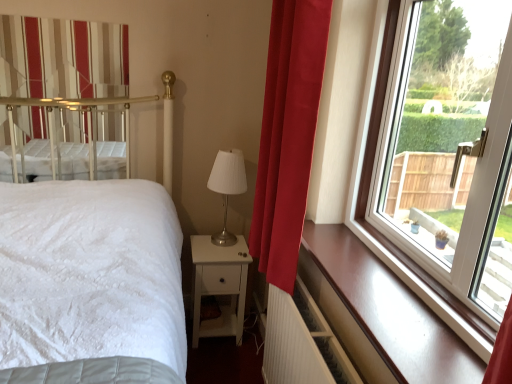
Image resolution: width=512 pixels, height=384 pixels. What do you see at coordinates (380, 314) in the screenshot? I see `glossy wood window sill at right` at bounding box center [380, 314].

What do you see at coordinates (227, 187) in the screenshot?
I see `metallic silver table lamp at center` at bounding box center [227, 187].

I want to click on white ribbed radiator at lower right, so click(302, 342).

Identify the location of velvet red curtain at right, which is the 2th curtain from back to front. The height and width of the screenshot is (384, 512). pos(288,135).

The image size is (512, 384). Describe the element at coordinates (448, 147) in the screenshot. I see `transparent glass window at right` at that location.

Identify the location of striped fabric curtain at upper left, the 1th curtain viewed from the left. (62, 58).

Where is `glossy wood window sill at right`? The image size is (512, 384). glossy wood window sill at right is located at coordinates (380, 314).

Would you say white matte nightstand at lower center is outside velvet red curtain at right, the first curtain when ordered from front to back?

white matte nightstand at lower center is positioned outside velvet red curtain at right, the first curtain when ordered from front to back.

Can you tell me how much white matte nightstand at lower center and velvet red curtain at right, which appears as the first curtain when viewed from the right, differ in facing direction?

There is a 89.6-degree angle between the facing directions of white matte nightstand at lower center and velvet red curtain at right, which appears as the first curtain when viewed from the right.

From the image's perspective, which is below, white matte nightstand at lower center or velvet red curtain at right, which is the 2th curtain from left to right?

From the image's view, white matte nightstand at lower center is below.

How far apart are white matte nightstand at lower center and velvet red curtain at right, which is the 2th curtain from left to right?

A distance of 31.47 inches exists between white matte nightstand at lower center and velvet red curtain at right, which is the 2th curtain from left to right.

Does point (28, 116) appear closer or farther from the camera than point (295, 96)?

Point (28, 116) is positioned farther from the camera compared to point (295, 96).

Between striped fabric curtain at upper left, the 1th curtain in the back-to-front sequence, and velvet red curtain at right, the first curtain when ordered from front to back, which one has more height?

velvet red curtain at right, the first curtain when ordered from front to back, is taller.

From the image's perspective, is striped fabric curtain at upper left, which is the second curtain in front-to-back order, below velvet red curtain at right, the first curtain when ordered from front to back?

No.

Is striped fabric curtain at upper left, the 1th curtain in the back-to-front sequence, facing away from velvet red curtain at right, the first curtain when ordered from front to back?

No, striped fabric curtain at upper left, the 1th curtain in the back-to-front sequence, is not facing the opposite direction of velvet red curtain at right, the first curtain when ordered from front to back.

Is velvet red curtain at right, which appears as the first curtain when viewed from the right, facing towards metallic silver table lamp at center?

No.

Based on the photo, is velvet red curtain at right, which appears as the first curtain when viewed from the right, completely or partially outside of metallic silver table lamp at center?

Absolutely, velvet red curtain at right, which appears as the first curtain when viewed from the right, is external to metallic silver table lamp at center.

From a real-world perspective, which is physically above, velvet red curtain at right, which appears as the first curtain when viewed from the right, or metallic silver table lamp at center?

velvet red curtain at right, which appears as the first curtain when viewed from the right, is physically above.

Between velvet red curtain at right, which appears as the first curtain when viewed from the right, and metallic silver table lamp at center, which one has smaller size?

With smaller size is metallic silver table lamp at center.

Between white ribbed radiator at lower right and transparent glass window at right, which one appears on the left side from the viewer's perspective?

Positioned to the left is white ribbed radiator at lower right.

Locate an element on the screen. The height and width of the screenshot is (384, 512). radiator directly beneath the transparent glass window at right (from a real-world perspective) is located at coordinates (302, 342).

Which of these two, white ribbed radiator at lower right or transparent glass window at right, is wider?

With larger width is transparent glass window at right.

Measure the distance between transparent glass window at right and velvet red curtain at right, the first curtain when ordered from front to back.

A distance of 17.04 inches exists between transparent glass window at right and velvet red curtain at right, the first curtain when ordered from front to back.

Between transparent glass window at right and velvet red curtain at right, the first curtain when ordered from front to back, which one is positioned behind?

velvet red curtain at right, the first curtain when ordered from front to back, is more distant.

Is transparent glass window at right aimed at velvet red curtain at right, which is the 2th curtain from left to right?

Yes.

Is transparent glass window at right far away from velvet red curtain at right, which is the 2th curtain from left to right?

No, transparent glass window at right is not far from velvet red curtain at right, which is the 2th curtain from left to right.

Can you confirm if transparent glass window at right is positioned to the right of glossy wood window sill at right?

Yes, transparent glass window at right is to the right of glossy wood window sill at right.

Is transparent glass window at right beside glossy wood window sill at right?

There is a gap between transparent glass window at right and glossy wood window sill at right.

Is transparent glass window at right taller than glossy wood window sill at right?

Indeed, transparent glass window at right has a greater height compared to glossy wood window sill at right.

Considering the relative sizes of transparent glass window at right and glossy wood window sill at right in the image provided, is transparent glass window at right bigger than glossy wood window sill at right?

Indeed, transparent glass window at right has a larger size compared to glossy wood window sill at right.

Which object is thinner, white ribbed radiator at lower right or glossy wood window sill at right?

With smaller width is white ribbed radiator at lower right.

Is white ribbed radiator at lower right far away from glossy wood window sill at right?

No, there isn't a large distance between white ribbed radiator at lower right and glossy wood window sill at right.

Considering the sizes of objects white ribbed radiator at lower right and glossy wood window sill at right in the image provided, who is bigger, white ribbed radiator at lower right or glossy wood window sill at right?

white ribbed radiator at lower right is bigger.

From the image's perspective, is white ribbed radiator at lower right above or below glossy wood window sill at right?

Based on their image positions, white ribbed radiator at lower right is located beneath glossy wood window sill at right.

Find the location of a particular element. This screenshot has width=512, height=384. curtain that appears on the right of white matte nightstand at lower center is located at coordinates (288, 135).

Image resolution: width=512 pixels, height=384 pixels. What are the coordinates of `curtain behind the velvet red curtain at right, the first curtain when ordered from front to back` in the screenshot? It's located at (62, 58).

From the image, which object appears to be nearer to glossy wood window sill at right, white matte nightstand at lower center or metallic silver table lamp at center?

The object closer to glossy wood window sill at right is white matte nightstand at lower center.

Which object lies further to the anchor point white ribbed radiator at lower right, velvet red curtain at right, which is the 2th curtain from back to front, or white matte nightstand at lower center?

white matte nightstand at lower center.

Looking at the image, which one is located closer to white ribbed radiator at lower right, transparent glass window at right or striped fabric curtain at upper left, the 1th curtain viewed from the left?

transparent glass window at right.

Which object lies further to the anchor point white ribbed radiator at lower right, white matte nightstand at lower center or transparent glass window at right?

white matte nightstand at lower center is positioned further to the anchor white ribbed radiator at lower right.

Looking at this image, from the image, which object appears to be nearer to metallic silver table lamp at center, velvet red curtain at right, which is the 2th curtain from back to front, or white ribbed radiator at lower right?

velvet red curtain at right, which is the 2th curtain from back to front, lies closer to metallic silver table lamp at center than the other object.

Looking at the image, which one is located further to velvet red curtain at right, which is the 2th curtain from back to front, striped fabric curtain at upper left, the 1th curtain viewed from the left, or metallic silver table lamp at center?

The object further to velvet red curtain at right, which is the 2th curtain from back to front, is striped fabric curtain at upper left, the 1th curtain viewed from the left.

Based on their spatial positions, is striped fabric curtain at upper left, positioned as the second curtain in right-to-left order, or white ribbed radiator at lower right further from transparent glass window at right?

striped fabric curtain at upper left, positioned as the second curtain in right-to-left order, is further to transparent glass window at right.

Which object lies further to the anchor point velvet red curtain at right, which is the 2th curtain from left to right, transparent glass window at right or metallic silver table lamp at center?

The object further to velvet red curtain at right, which is the 2th curtain from left to right, is metallic silver table lamp at center.

Locate an element on the screen. Image resolution: width=512 pixels, height=384 pixels. radiator between striped fabric curtain at upper left, positioned as the second curtain in right-to-left order, and transparent glass window at right from left to right is located at coordinates (302, 342).

The width and height of the screenshot is (512, 384). Identify the location of nightstand between striped fabric curtain at upper left, the 1th curtain viewed from the left, and velvet red curtain at right, the first curtain when ordered from front to back, from left to right. (220, 285).

Locate an element on the screen. table lamp between transparent glass window at right and white matte nightstand at lower center in the front-back direction is located at coordinates (227, 187).

Locate an element on the screen. This screenshot has width=512, height=384. table lamp between glossy wood window sill at right and white matte nightstand at lower center from front to back is located at coordinates (227, 187).